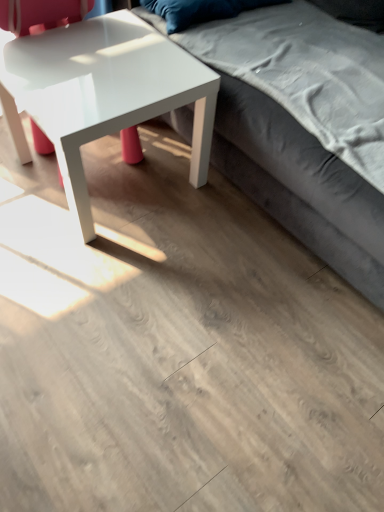
Identify the location of unoccupied area in front of glossy white coffee table at left. The image size is (384, 512). (102, 271).